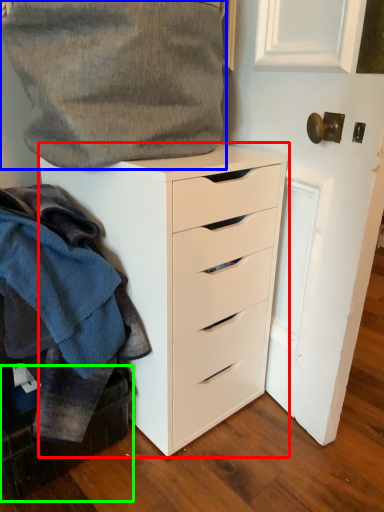
Question: Which object is positioned closest to chest of drawers (highlighted by a red box)? Select from gray (highlighted by a blue box) and cabinetry (highlighted by a green box).

Choices:
 (A) gray
 (B) cabinetry

Answer: (A)